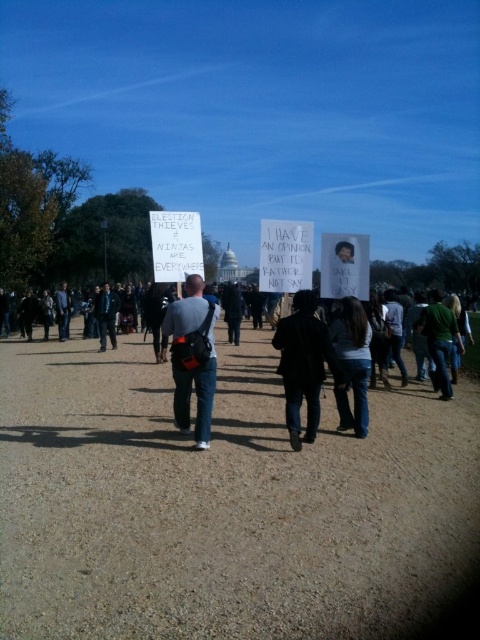
Question: Estimate the real-world distances between objects in this image. Which object is closer to the gray fabric backpack at center?

Choices:
 (A) green fabric shirt at center
 (B) denim jacket at left
 (C) dark gray jeans at center

Answer: (C)

Question: Which object appears closest to the camera in this image?

Choices:
 (A) brown gravel at center
 (B) green fabric shirt at center
 (C) gray fabric backpack at center

Answer: (A)

Question: Which of the following is the closest to the observer?

Choices:
 (A) (271, 548)
 (B) (451, 323)
 (C) (147, 500)

Answer: (A)

Question: Does brown gravel at center lie in front of green fabric shirt at center?

Choices:
 (A) no
 (B) yes

Answer: (B)

Question: Observing the image, what is the correct spatial positioning of brown gravel at center in reference to gray fabric backpack at center?

Choices:
 (A) right
 (B) left

Answer: (B)

Question: Is dark gray jeans at center closer to the viewer compared to denim jacket at left?

Choices:
 (A) no
 (B) yes

Answer: (B)